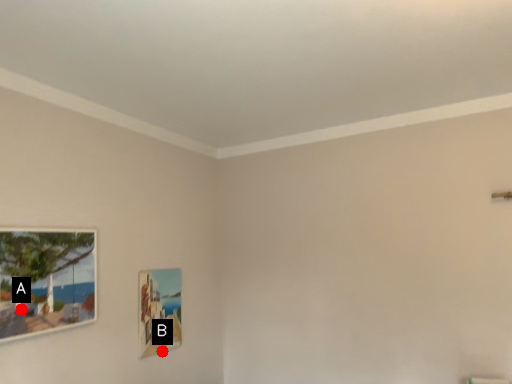
Question: Two points are circled on the image, labeled by A and B beside each circle. Which point is closer to the camera taking this photo?

Choices:
 (A) A is closer
 (B) B is closer

Answer: (A)